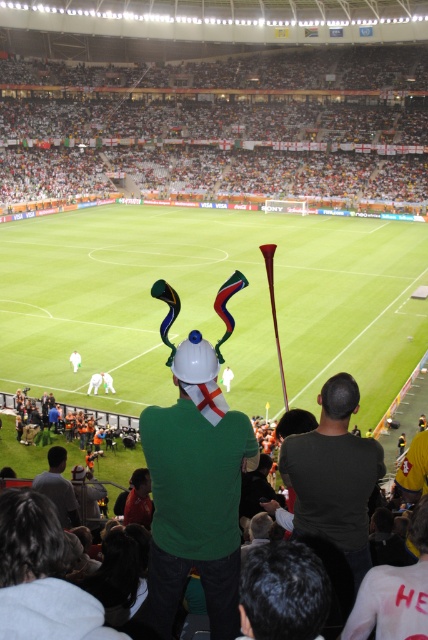
Measure the distance from dark brown hair at center to gray fabric shirt at lower left.

The distance of dark brown hair at center from gray fabric shirt at lower left is 24.82 feet.

Is point (318, 595) farther from viewer compared to point (53, 497)?

That is False.

Locate an element on the screen. The height and width of the screenshot is (640, 428). dark brown hair at center is located at coordinates (282, 593).

Who is lower down, green matte helmet at center or dark brown hair at center?

dark brown hair at center

Who is positioned more to the left, green matte helmet at center or dark brown hair at center?

green matte helmet at center is more to the left.

Does point (204, 508) lie in front of point (318, 628)?

No, it is not.

Identify the location of green matte helmet at center. Image resolution: width=428 pixels, height=640 pixels. (196, 490).

Is green grass at center wider than dark brown hair at center?

Yes.

Between green grass at center and dark brown hair at center, which one is positioned lower?

dark brown hair at center

Identify the location of green grass at center. The width and height of the screenshot is (428, 640). (211, 301).

The height and width of the screenshot is (640, 428). I want to click on green grass at center, so click(211, 301).